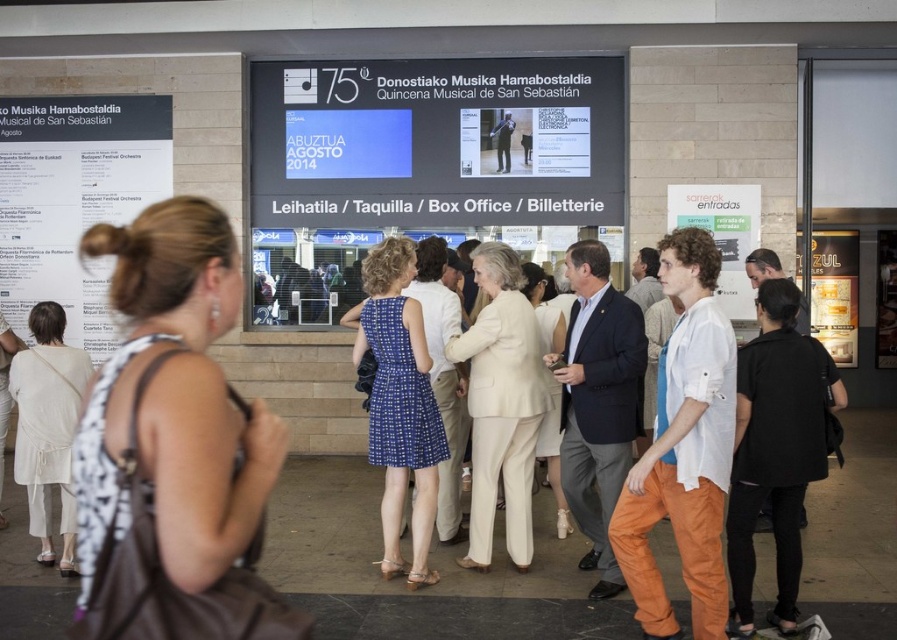
You are standing in the ticketing area for the Donostiako Musika Hamabostaldia festival. You notice two points marked on the floor. The first point is at coordinates point (151, 141) and the second is at point (845, 358). If you want to move towards the point that is closer to the entrance, which coordinate should you head towards?

Point (151, 141) is in front of point (845, 358), so it is closer to the entrance. Therefore, you should head towards point (151, 141).

What are the coordinates of the white cotton shirt at center?

The white cotton shirt at center is located at point (x=684, y=449).